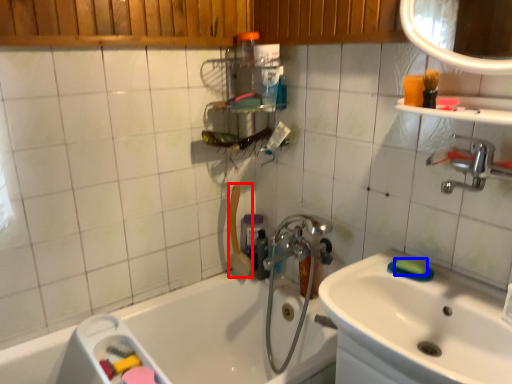
Question: Among these objects, which one is nearest to the camera, shower (highlighted by a red box) or soap (highlighted by a blue box)?

Choices:
 (A) shower
 (B) soap

Answer: (B)